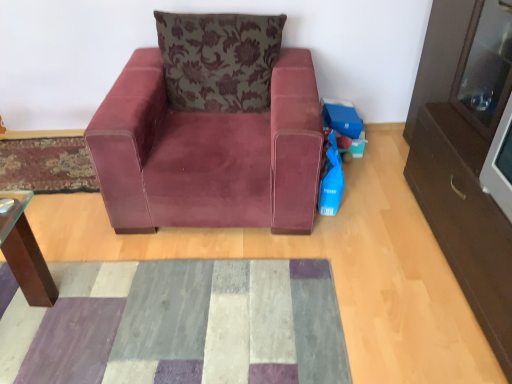
Image resolution: width=512 pixels, height=384 pixels. What are the coordinates of `blank space to the left of velvet maroon armchair at center` in the screenshot? It's located at (57, 185).